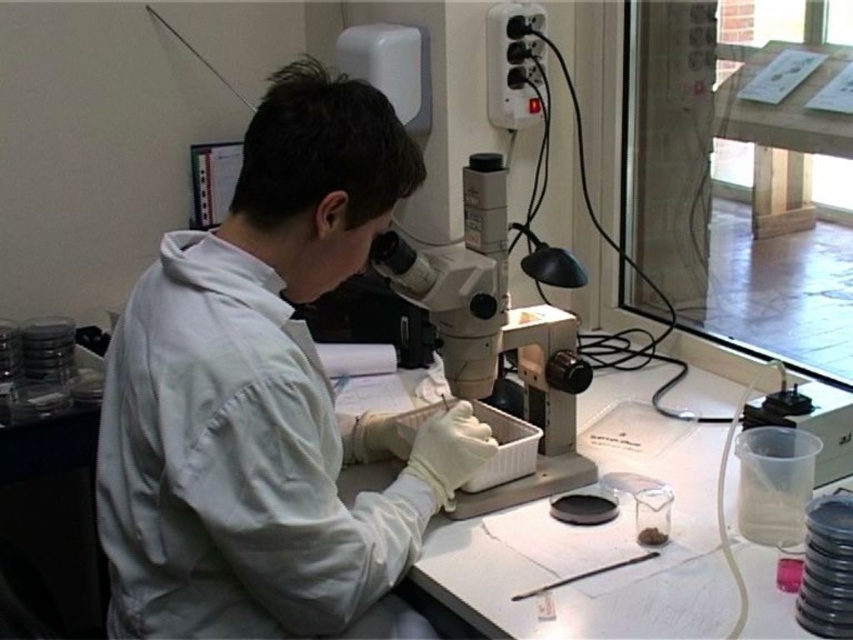
You are a new lab assistant and need to locate the white matte lab coat at center and the white plastic microscope at center. According to the layout, which object is positioned to the left?

The white matte lab coat at center is to the left of the white plastic microscope at center, so the lab coat is positioned to the left.

You are a researcher in the lab. You need to identify which of the two points, point (x=471, y=451) or point (x=532, y=483), is closer to the camera. Based on the information provided, which point is closer?

Point (x=471, y=451) is closer to the camera than point (x=532, y=483).

You are a lab assistant who needs to adjust the white plastic microscope at center. Since the white matte lab coat at center is in the way, can you lift the lab coat to access the microscope?

The white matte lab coat at center is below the white plastic microscope at center, so lifting the lab coat would allow access to the microscope.